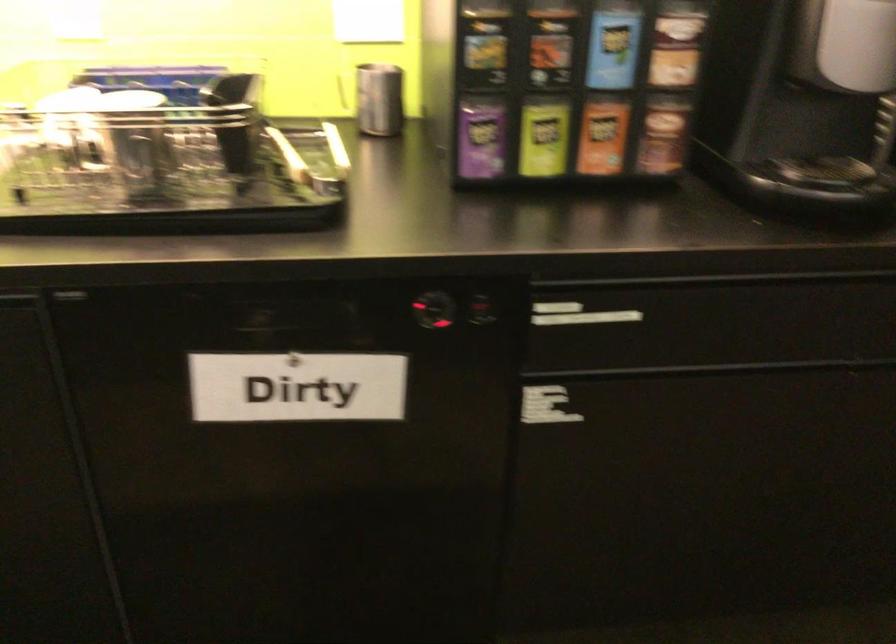
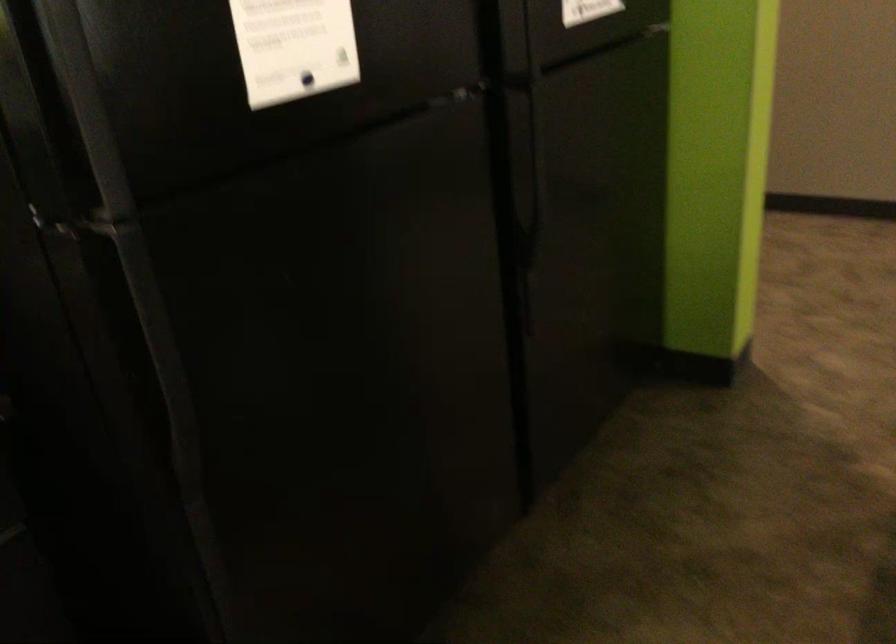
Question: Based on the continuous images, in which direction is the camera rotating? Reply with the corresponding letter.

Choices:
 (A) Left
 (B) Right
 (C) Up
 (D) Down

Answer: (B)